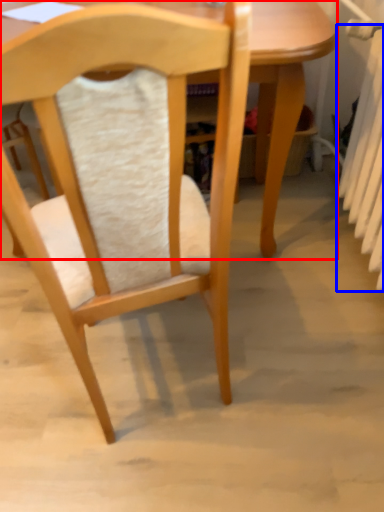
Question: Which point is closer to the camera, table (highlighted by a red box) or radiator (highlighted by a blue box)?

Choices:
 (A) table
 (B) radiator

Answer: (B)